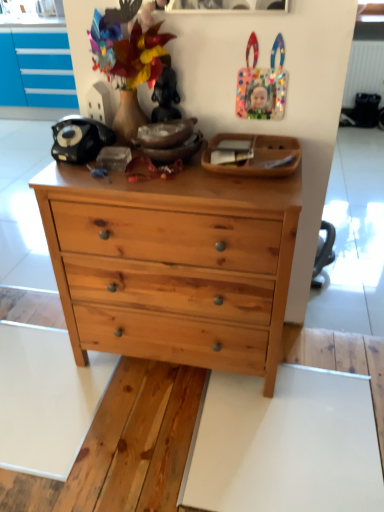
Identify the location of wooden tray at upper center. Image resolution: width=384 pixels, height=512 pixels. (255, 155).

What do you see at coordinates (255, 155) in the screenshot? Image resolution: width=384 pixels, height=512 pixels. I see `wooden tray at upper center` at bounding box center [255, 155].

Identify the location of natural wood chest of drawers at center. (173, 265).

This screenshot has height=512, width=384. What do you see at coordinates (173, 265) in the screenshot?
I see `natural wood chest of drawers at center` at bounding box center [173, 265].

What is the approximate width of natural wood chest of drawers at center?

It is 16.98 inches.

Locate an element on the screen. The image size is (384, 512). wooden tray at upper center is located at coordinates (255, 155).

Considering the positions of objects natural wood chest of drawers at center and wooden tray at upper center in the image provided, who is more to the left, natural wood chest of drawers at center or wooden tray at upper center?

natural wood chest of drawers at center is more to the left.

Who is more distant, natural wood chest of drawers at center or wooden tray at upper center?

wooden tray at upper center is more distant.

Considering the points (75, 178) and (263, 175), which point is behind, point (75, 178) or point (263, 175)?

The point (75, 178) is more distant.

From the image's perspective, between natural wood chest of drawers at center and wooden tray at upper center, who is located below?

From the image's view, natural wood chest of drawers at center is below.

From a real-world perspective, is natural wood chest of drawers at center above or below wooden tray at upper center?

From a real-world perspective, natural wood chest of drawers at center is physically below wooden tray at upper center.

Considering the sizes of natural wood chest of drawers at center and wooden tray at upper center in the image, is natural wood chest of drawers at center wider or thinner than wooden tray at upper center?

natural wood chest of drawers at center is wider than wooden tray at upper center.

Based on the photo, from their relative heights in the image, would you say natural wood chest of drawers at center is taller or shorter than wooden tray at upper center?

In the image, natural wood chest of drawers at center appears to be taller than wooden tray at upper center.

Does natural wood chest of drawers at center have a smaller size compared to wooden tray at upper center?

No, natural wood chest of drawers at center is not smaller than wooden tray at upper center.

Would you say natural wood chest of drawers at center is inside or outside wooden tray at upper center?

natural wood chest of drawers at center is located beyond the bounds of wooden tray at upper center.

Is natural wood chest of drawers at center placed right next to wooden tray at upper center?

No, natural wood chest of drawers at center is not next to wooden tray at upper center.

Is natural wood chest of drawers at center facing away from wooden tray at upper center?

No, natural wood chest of drawers at center is not facing away from wooden tray at upper center.

Locate an element on the screen. This screenshot has height=512, width=384. the chest of drawers lying below the wooden tray at upper center (from the image's perspective) is located at coordinates (173, 265).

From the picture: Would you say wooden tray at upper center is to the left or to the right of natural wood chest of drawers at center in the picture?

In the image, wooden tray at upper center appears on the right side of natural wood chest of drawers at center.

Is wooden tray at upper center in front of or behind natural wood chest of drawers at center in the image?

Clearly, wooden tray at upper center is behind natural wood chest of drawers at center.

Which point is more forward, (289, 172) or (110, 342)?

Positioned in front is point (289, 172).

From the image's perspective, is wooden tray at upper center below natural wood chest of drawers at center?

Actually, wooden tray at upper center appears above natural wood chest of drawers at center in the image.

From a real-world perspective, does wooden tray at upper center stand above natural wood chest of drawers at center?

Yes, from a real-world perspective, wooden tray at upper center is on top of natural wood chest of drawers at center.

Is wooden tray at upper center wider or thinner than natural wood chest of drawers at center?

In the image, wooden tray at upper center appears to be more narrow than natural wood chest of drawers at center.

In the scene shown: Considering the relative sizes of wooden tray at upper center and natural wood chest of drawers at center in the image provided, is wooden tray at upper center shorter than natural wood chest of drawers at center?

Correct, wooden tray at upper center is not as tall as natural wood chest of drawers at center.

Looking at the image, does wooden tray at upper center seem bigger or smaller compared to natural wood chest of drawers at center?

Clearly, wooden tray at upper center is smaller in size than natural wood chest of drawers at center.

Is wooden tray at upper center spatially inside natural wood chest of drawers at center, or outside of it?

wooden tray at upper center is spatially situated outside natural wood chest of drawers at center.

Is wooden tray at upper center far from natural wood chest of drawers at center?

They are positioned close to each other.

Is natural wood chest of drawers at center at the back of wooden tray at upper center?

No, natural wood chest of drawers at center is not at the back of wooden tray at upper center.

Can you tell me how much wooden tray at upper center and natural wood chest of drawers at center differ in facing direction?

The angular difference between wooden tray at upper center and natural wood chest of drawers at center is 0.0225 degrees.

Image resolution: width=384 pixels, height=512 pixels. Find the location of `plate above the natural wood chest of drawers at center (from the image's perspective)`. plate above the natural wood chest of drawers at center (from the image's perspective) is located at coordinates (255, 155).

Identify the location of chest of drawers on the left of wooden tray at upper center. The height and width of the screenshot is (512, 384). (173, 265).

Locate an element on the screen. plate located above the natural wood chest of drawers at center (from the image's perspective) is located at coordinates (255, 155).